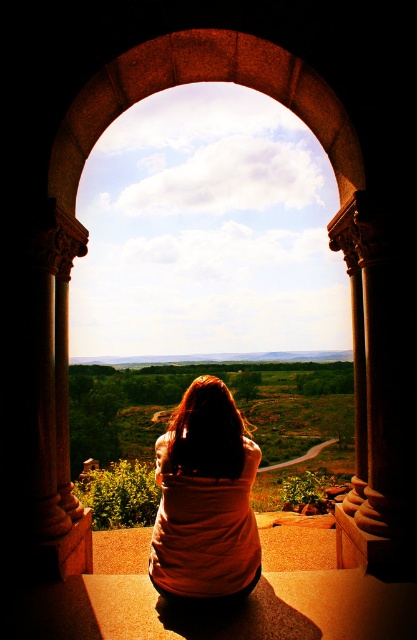
Question: Is matte orange shirt at center above stone archway at center?

Choices:
 (A) no
 (B) yes

Answer: (A)

Question: Among these points, which one is farthest from the camera?

Choices:
 (A) (191, 570)
 (B) (120, 54)

Answer: (B)

Question: Which of the following is the closest to the observer?

Choices:
 (A) (165, 465)
 (B) (238, 81)

Answer: (A)

Question: Does matte orange shirt at center appear under stone archway at center?

Choices:
 (A) yes
 (B) no

Answer: (A)

Question: Which of the following is the closest to the observer?

Choices:
 (A) matte orange shirt at center
 (B) stone archway at center

Answer: (A)

Question: Can you confirm if matte orange shirt at center is smaller than stone archway at center?

Choices:
 (A) yes
 (B) no

Answer: (A)